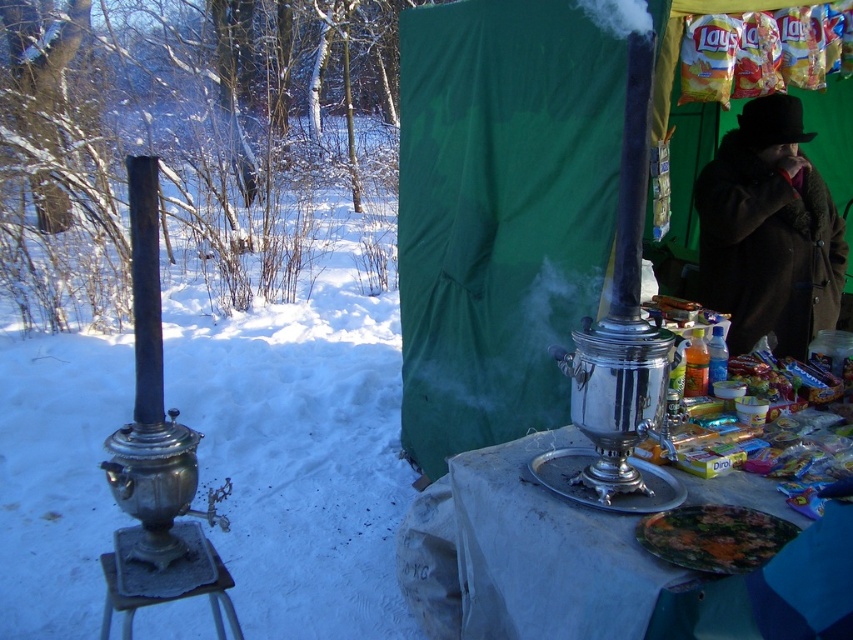
Measure the distance from shiny silver samovar at center to brown woolen coat at right.

shiny silver samovar at center and brown woolen coat at right are 1.76 meters apart from each other.

Can you confirm if shiny silver samovar at center is thinner than brown woolen coat at right?

Yes.

The width and height of the screenshot is (853, 640). Find the location of `shiny silver samovar at center`. shiny silver samovar at center is located at coordinates (625, 572).

I want to click on shiny silver samovar at center, so point(625,572).

Is point (517, 412) positioned after point (821, 566)?

Yes, it is.

Is point (445, 228) farther from camera compared to point (532, 497)?

Yes, it is behind point (532, 497).

In order to click on shiny metallic samovar at center in this screenshot , I will do click(x=498, y=212).

Is shiny metallic samovar at center below brown woolen coat at right?

No.

Who is more distant from viewer, [663,24] or [787,156]?

The point [787,156] is behind.

Between point (598, 298) and point (730, 180), which one is positioned behind?

The point (730, 180) is behind.

Locate an element on the screen. This screenshot has width=853, height=640. shiny metallic samovar at center is located at coordinates (498, 212).